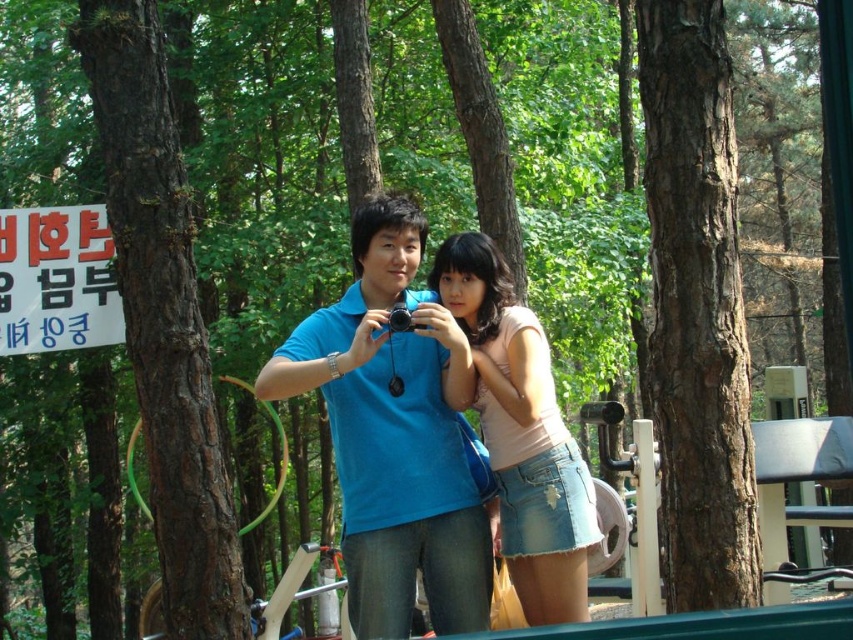
Does blue cotton shirt at center have a larger size compared to brown rough bark tree at center?

Correct, blue cotton shirt at center is larger in size than brown rough bark tree at center.

Is blue cotton shirt at center wider than brown rough bark tree at center?

Yes.

Image resolution: width=853 pixels, height=640 pixels. What are the coordinates of `blue cotton shirt at center` in the screenshot? It's located at (398, 435).

The height and width of the screenshot is (640, 853). Find the location of `brown rough bark tree at center`. brown rough bark tree at center is located at coordinates (695, 308).

Based on the photo, is brown rough bark tree at center to the right of brown rough bark tree at left from the viewer's perspective?

Yes, brown rough bark tree at center is to the right of brown rough bark tree at left.

Who is more distant from viewer, (657, 3) or (149, 360)?

Point (149, 360)

You are a GUI agent. You are given a task and a screenshot of the screen. Output one action in this format:
    pyautogui.click(x=<x>, y=<y>)
    Task: Click on the brown rough bark tree at center
    Image resolution: width=853 pixels, height=640 pixels.
    Given the screenshot: What is the action you would take?
    pyautogui.click(x=695, y=308)

How far apart are brown rough bark tree at center and pink denim skirt at center?

A distance of 31.17 inches exists between brown rough bark tree at center and pink denim skirt at center.

Based on the photo, who is lower down, brown rough bark tree at center or pink denim skirt at center?

pink denim skirt at center is lower down.

Does point (730, 144) come closer to viewer compared to point (509, 394)?

No, it is behind (509, 394).

Image resolution: width=853 pixels, height=640 pixels. Identify the location of brown rough bark tree at center. tap(695, 308).